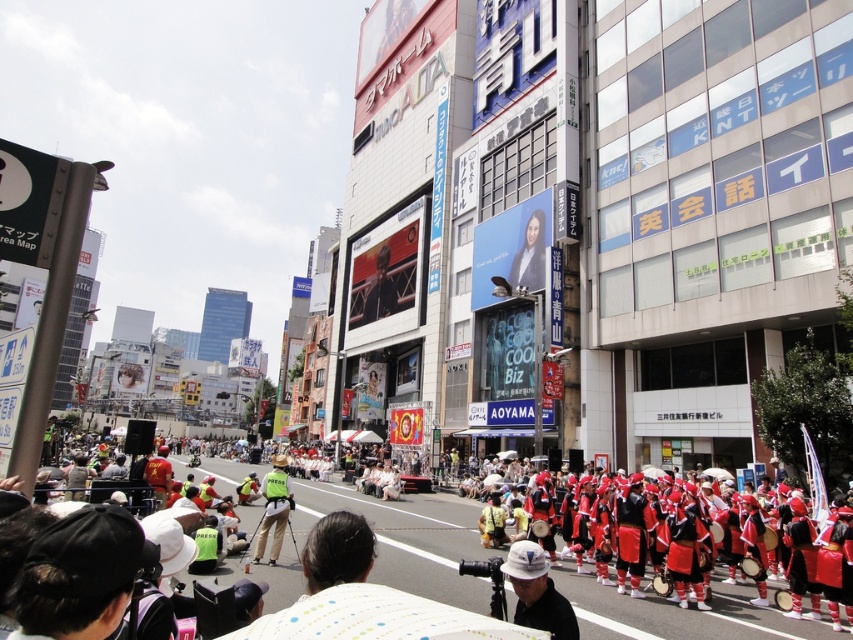
Looking at this image, does red fabric drum at center appear on the right side of white matte baseball cap at center?

No, red fabric drum at center is not to the right of white matte baseball cap at center.

Who is more distant from viewer, (511,614) or (508,566)?

Point (511,614)

Between point (654, 616) and point (517, 612), which one is positioned in front?

Point (517, 612) is more forward.

The width and height of the screenshot is (853, 640). Identify the location of red fabric drum at center. pyautogui.click(x=408, y=538).

Is red fabric drum at center further to the viewer compared to green reflective vest at center?

No, it is in front of green reflective vest at center.

I want to click on red fabric drum at center, so click(408, 538).

Can you confirm if white matte baseball cap at center is shorter than green reflective vest at center?

Yes, white matte baseball cap at center is shorter than green reflective vest at center.

Is white matte baseball cap at center wider than green reflective vest at center?

No.

Describe the element at coordinates (537, 593) in the screenshot. I see `white matte baseball cap at center` at that location.

This screenshot has height=640, width=853. Find the location of `white matte baseball cap at center`. white matte baseball cap at center is located at coordinates (537, 593).